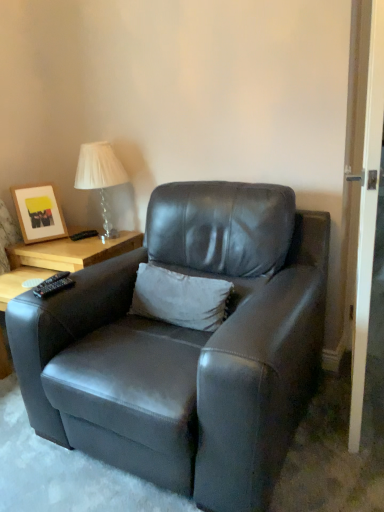
Question: Can you confirm if white wood screen door at right is positioned to the left of matte wooden picture frame at upper left?

Choices:
 (A) yes
 (B) no

Answer: (B)

Question: Does white wood screen door at right come behind matte wooden picture frame at upper left?

Choices:
 (A) no
 (B) yes

Answer: (A)

Question: Can you confirm if white wood screen door at right is shorter than matte wooden picture frame at upper left?

Choices:
 (A) no
 (B) yes

Answer: (A)

Question: Is white wood screen door at right positioned beyond the bounds of matte wooden picture frame at upper left?

Choices:
 (A) no
 (B) yes

Answer: (B)

Question: From a real-world perspective, is white wood screen door at right over matte wooden picture frame at upper left?

Choices:
 (A) no
 (B) yes

Answer: (B)

Question: Is matte wooden picture frame at upper left inside the boundaries of black plastic remote at lower left, or outside?

Choices:
 (A) inside
 (B) outside

Answer: (B)

Question: Considering the positions of matte wooden picture frame at upper left and black plastic remote at lower left in the image, is matte wooden picture frame at upper left taller or shorter than black plastic remote at lower left?

Choices:
 (A) short
 (B) tall

Answer: (B)

Question: Looking at their shapes, would you say matte wooden picture frame at upper left is wider or thinner than black plastic remote at lower left?

Choices:
 (A) wide
 (B) thin

Answer: (A)

Question: From the image's perspective, relative to black plastic remote at lower left, is matte wooden picture frame at upper left above or below?

Choices:
 (A) below
 (B) above

Answer: (B)

Question: Is black plastic remote at lower left bigger or smaller than clear glass table lamp at upper left?

Choices:
 (A) big
 (B) small

Answer: (B)

Question: In terms of height, does black plastic remote at lower left look taller or shorter compared to clear glass table lamp at upper left?

Choices:
 (A) short
 (B) tall

Answer: (A)

Question: Is black plastic remote at lower left to the left or to the right of clear glass table lamp at upper left in the image?

Choices:
 (A) right
 (B) left

Answer: (B)

Question: Which is correct: black plastic remote at lower left is inside clear glass table lamp at upper left, or outside of it?

Choices:
 (A) outside
 (B) inside

Answer: (A)

Question: Is point (91, 159) closer or farther from the camera than point (46, 237)?

Choices:
 (A) farther
 (B) closer

Answer: (B)

Question: Is clear glass table lamp at upper left situated inside matte wooden picture frame at upper left or outside?

Choices:
 (A) inside
 (B) outside

Answer: (B)